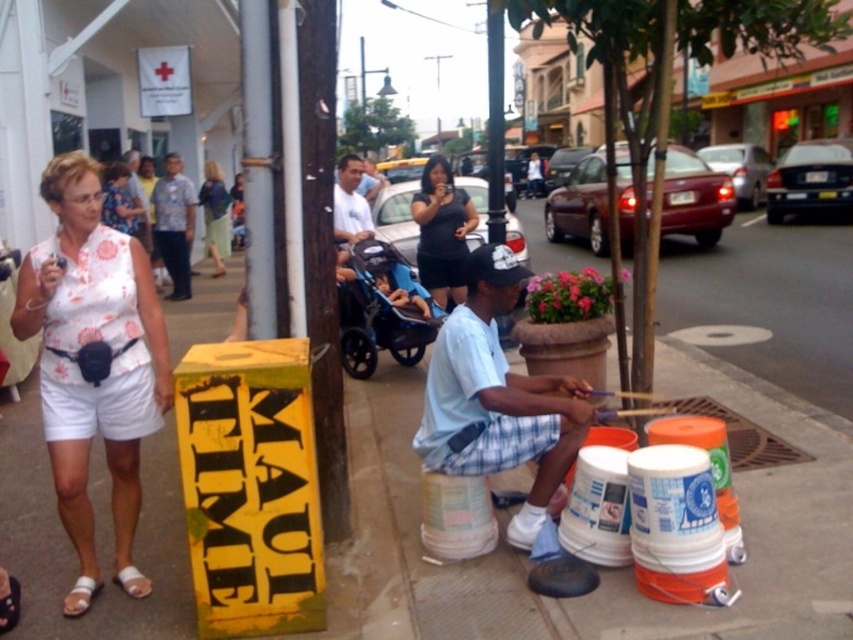
You are a photographer standing in the street scene and want to capture a photo of both the white cotton shorts at lower left and the light blue shirt at center. Based on their positions, can you fit both into the frame without moving your camera? Explain why or why not.

The white cotton shorts at lower left is below the light blue shirt at center, so they are vertically aligned. Since they are positioned in a vertical line, you can likely fit both into the frame by adjusting the camera angle or zoom to include both the lower and central areas of the scene.

You are a photographer standing in the street scene and want to take a photo of both the man playing drums and the potted plant with pink flowers. You notice two points marked in the image. Which point is closer to you, point (x=132, y=468) or point (x=572, y=416)?

Point (x=132, y=468) is closer to you than point (x=572, y=416) because it is further to the viewer according to the description.